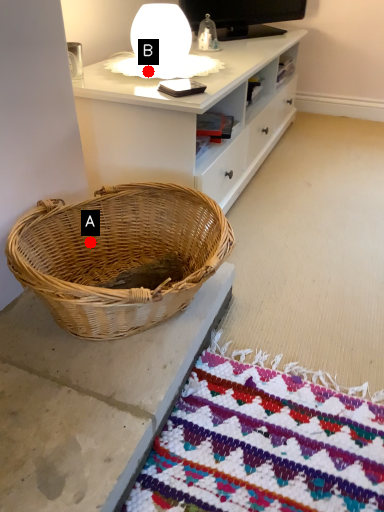
Question: Two points are circled on the image, labeled by A and B beside each circle. Which of the following is the closest to the observer?

Choices:
 (A) A is closer
 (B) B is closer

Answer: (A)